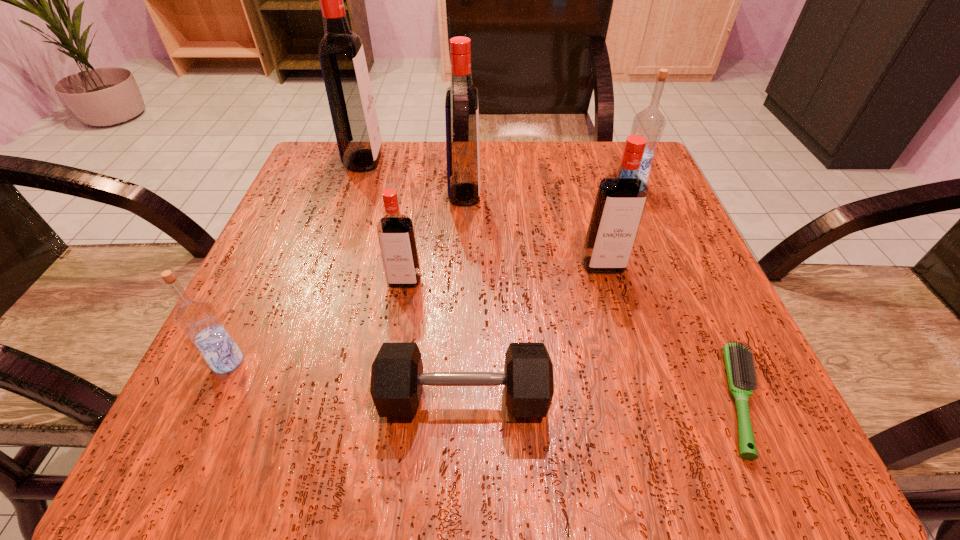
In the image, there is a desktop. Where is `vacant region at the left edge`? The width and height of the screenshot is (960, 540). vacant region at the left edge is located at coordinates (238, 331).

This screenshot has width=960, height=540. In the image, there is a desktop. In order to click on vacant space at the right edge in this screenshot , I will do `click(651, 375)`.

Identify the location of vacant region at the far left corner of the desktop. The width and height of the screenshot is (960, 540). (335, 185).

This screenshot has width=960, height=540. Identify the location of free space at the near left corner of the desktop. (249, 405).

At what (x,y) coordinates should I click in order to perform the action: click on empty location between the fifth shortest vodka and the second shortest object. Please return your answer as a coordinate pair (x, y). Looking at the image, I should click on (465, 296).

The height and width of the screenshot is (540, 960). Identify the location of vacant area that lies between the right blue vodka and the leftmost vodka. (429, 273).

Where is `unoccupied position between the dumbbell and the leftmost object`? unoccupied position between the dumbbell and the leftmost object is located at coordinates (346, 379).

Where is `free spot between the dumbbell and the leftmost vodka`? The width and height of the screenshot is (960, 540). free spot between the dumbbell and the leftmost vodka is located at coordinates (346, 379).

At what (x,y) coordinates should I click in order to perform the action: click on vacant region between the left blue vodka and the fifth shortest vodka. Please return your answer as a coordinate pair (x, y). Looking at the image, I should click on (347, 278).

The image size is (960, 540). What are the coordinates of `free space that is in between the fifth vodka from right to left and the third red vodka from left to right` in the screenshot? It's located at (415, 178).